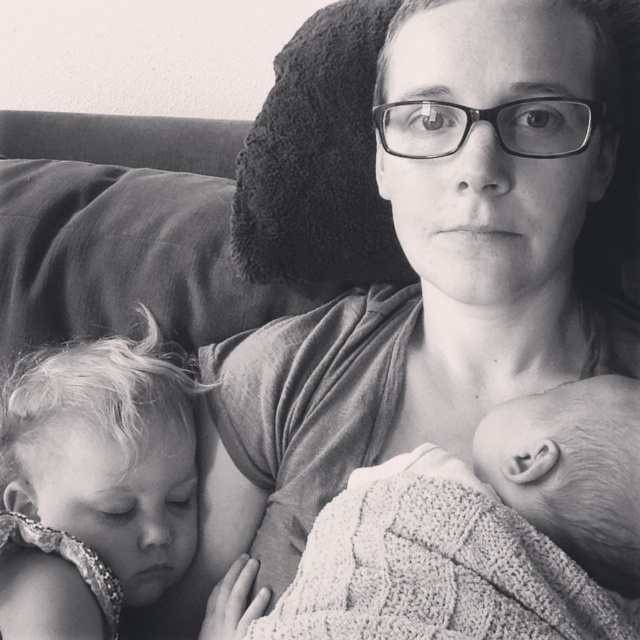
From the picture: You are a photographer analyzing the composition of this black and white photo. You need to locate the matte gray shirt at center precisely. What are its coordinates?

The coordinates of the matte gray shirt at center are at point (426, 275).

In the scene shown: You are a photographer trying to capture a closeup of the matte gray shirt at center and the knitted fabric baby at center in the scene. Which object should you focus on first if you want to ensure both are in focus without adjusting the camera settings?

The matte gray shirt at center is taller than the knitted fabric baby at center, so focusing on the taller matte gray shirt at center first will help ensure both are in focus since it is closer to the camera.